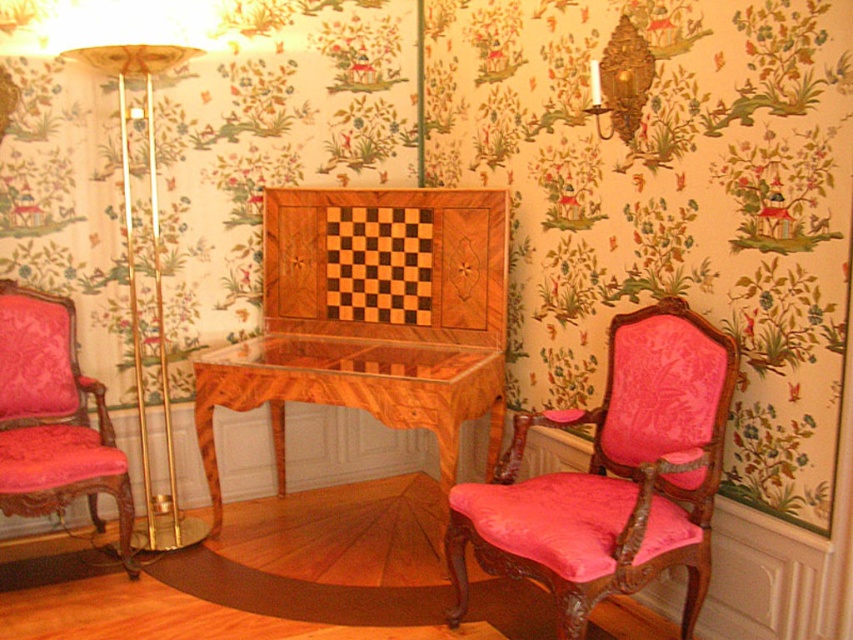
You are arranging a small reading nook in the room and need to place the velvet pink armchair at left and the gold metallic floor lamp at left. Which object should you place closer to the desk to ensure proper visibility for reading?

The velvet pink armchair at left is shorter than the gold metallic floor lamp at left, so you should place the velvet pink armchair at left closer to the desk to avoid the lamp blocking the light.

You are a guest entering the room and want to sit down. Which object would you need to look up to see from the floor level? The pink velvet armchair at right or the wooden table at center?

The pink velvet armchair at right is much taller than the wooden table at center, so you would need to look up to see the pink velvet armchair at right from the floor level.